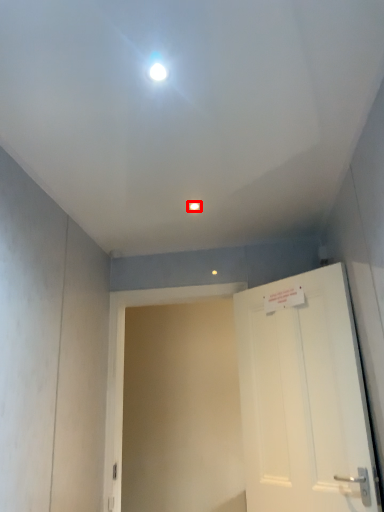
Question: From the image's perspective, what is the correct spatial relationship of light fixture (annotated by the red box) in relation to door?

Choices:
 (A) above
 (B) below

Answer: (A)